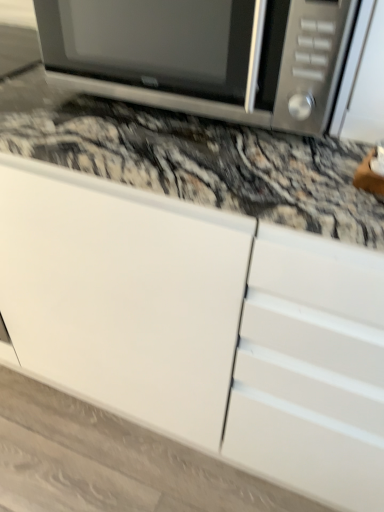
Question: Should I look upward or downward to see satin silver microwave at upper center?

Choices:
 (A) down
 (B) up

Answer: (B)

Question: Is satin silver microwave at upper center touching white matte cabinet at upper center?

Choices:
 (A) yes
 (B) no

Answer: (B)

Question: From the image's perspective, is satin silver microwave at upper center below white matte cabinet at upper center?

Choices:
 (A) no
 (B) yes

Answer: (A)

Question: From a real-world perspective, is satin silver microwave at upper center over white matte cabinet at upper center?

Choices:
 (A) yes
 (B) no

Answer: (A)

Question: Does satin silver microwave at upper center have a larger size compared to white matte cabinet at upper center?

Choices:
 (A) no
 (B) yes

Answer: (A)

Question: Does satin silver microwave at upper center have a lesser height compared to white matte cabinet at upper center?

Choices:
 (A) no
 (B) yes

Answer: (B)

Question: Is satin silver microwave at upper center to the right of white matte cabinet at upper center from the viewer's perspective?

Choices:
 (A) yes
 (B) no

Answer: (A)

Question: Does white matte cabinet at upper center appear on the right side of satin silver microwave at upper center?

Choices:
 (A) yes
 (B) no

Answer: (B)

Question: Does white matte cabinet at upper center have a greater height compared to satin silver microwave at upper center?

Choices:
 (A) yes
 (B) no

Answer: (A)

Question: Are white matte cabinet at upper center and satin silver microwave at upper center located far from each other?

Choices:
 (A) yes
 (B) no

Answer: (B)

Question: Considering the relative sizes of white matte cabinet at upper center and satin silver microwave at upper center in the image provided, is white matte cabinet at upper center bigger than satin silver microwave at upper center?

Choices:
 (A) no
 (B) yes

Answer: (B)

Question: Considering the relative sizes of white matte cabinet at upper center and satin silver microwave at upper center in the image provided, is white matte cabinet at upper center thinner than satin silver microwave at upper center?

Choices:
 (A) yes
 (B) no

Answer: (B)

Question: Is white matte cabinet at upper center with satin silver microwave at upper center?

Choices:
 (A) yes
 (B) no

Answer: (B)

Question: From a real-world perspective, is satin silver microwave at upper center positioned above or below white matte cabinet at upper center?

Choices:
 (A) below
 (B) above

Answer: (B)